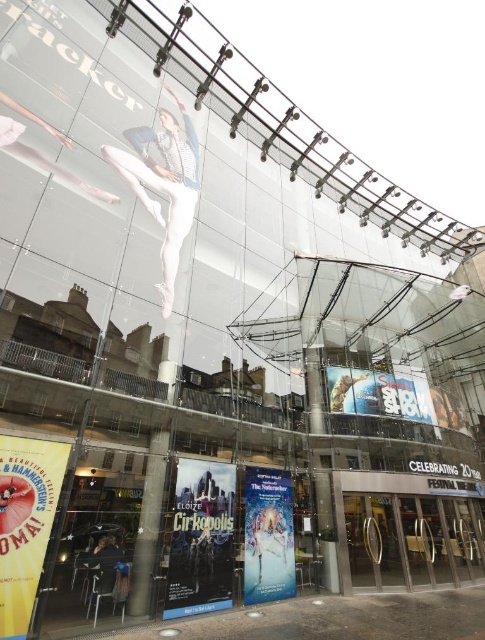
Does point (231, 481) come farther from viewer compared to point (293, 557)?

No.

How distant is blue glossy poster at center from white paper poster at center?

3.31 feet

Between point (210, 467) and point (253, 493), which one is positioned behind?

Positioned behind is point (253, 493).

Image resolution: width=485 pixels, height=640 pixels. I want to click on blue glossy poster at center, so click(200, 538).

Who is positioned more to the right, yellow paper poster at lower left or matte white ballet dancer at upper center?

Positioned to the right is matte white ballet dancer at upper center.

Does yellow paper poster at lower left appear on the left side of matte white ballet dancer at upper center?

Yes, yellow paper poster at lower left is to the left of matte white ballet dancer at upper center.

I want to click on yellow paper poster at lower left, so click(26, 522).

Between silver metallic doors at center and blue glossy poster at center, which one appears on the left side from the viewer's perspective?

From the viewer's perspective, blue glossy poster at center appears more on the left side.

Does point (481, 554) come in front of point (194, 602)?

No, (481, 554) is behind (194, 602).

Does point (383, 502) come farther from viewer compared to point (207, 477)?

Yes, point (383, 502) is farther from viewer.

You are a GUI agent. You are given a task and a screenshot of the screen. Output one action in this format:
    pyautogui.click(x=<x>, y=<y>)
    Task: Click on the silver metallic doors at center
    This screenshot has height=640, width=485.
    Given the screenshot: What is the action you would take?
    pyautogui.click(x=407, y=529)